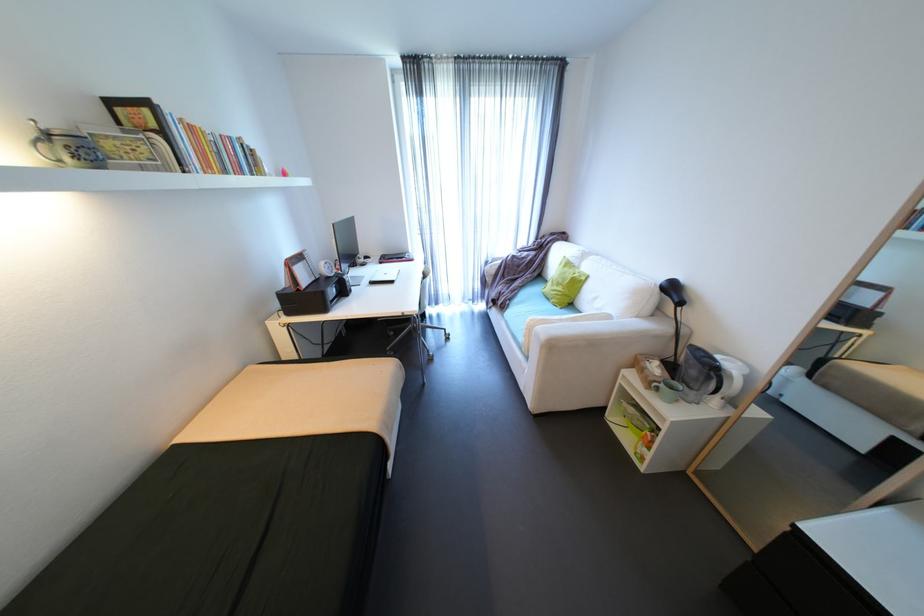
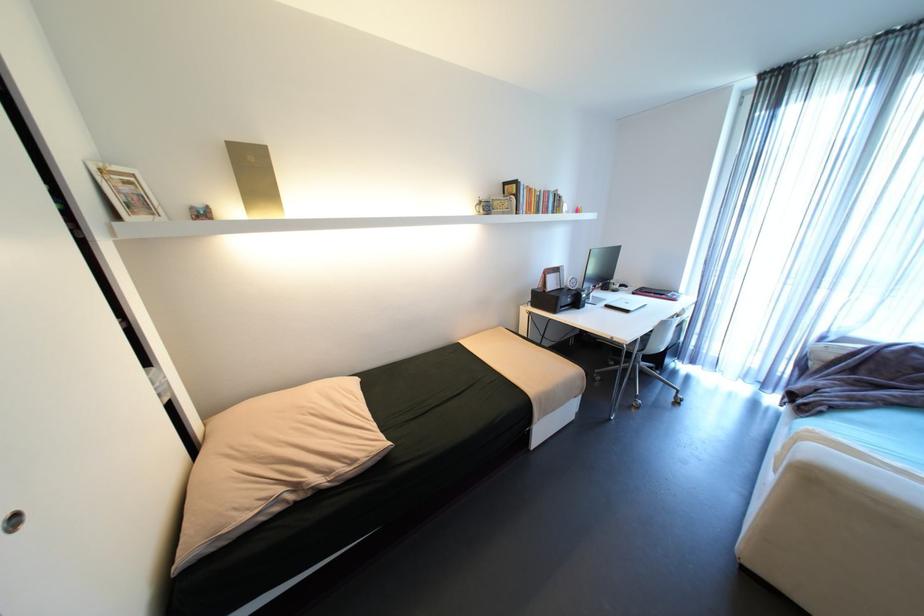
Question: Based on the continuous images, in which direction is the camera rotating? Reply with the corresponding letter.

Choices:
 (A) Left
 (B) Right
 (C) Up
 (D) Down

Answer: (A)